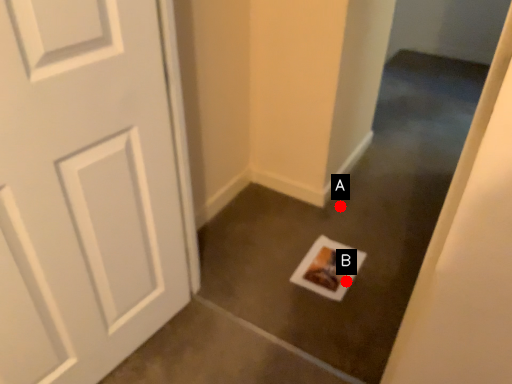
Question: Two points are circled on the image, labeled by A and B beside each circle. Which point is closer to the camera?

Choices:
 (A) A is closer
 (B) B is closer

Answer: (B)